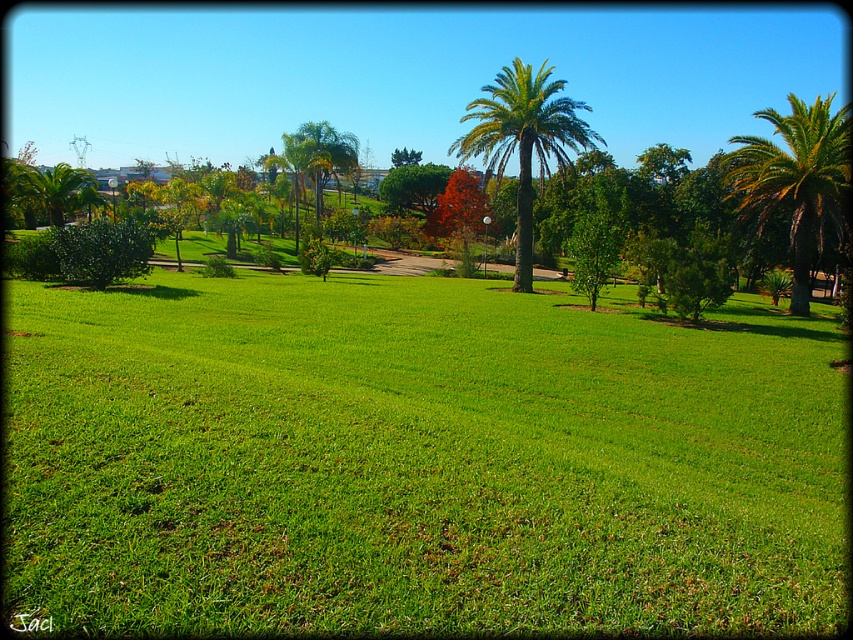
Does green leafy palm tree at right have a lesser width compared to green leafy palm at center?

No.

At what (x,y) coordinates should I click in order to perform the action: click on green leafy palm tree at right. Please return your answer as a coordinate pair (x, y). Looking at the image, I should click on (795, 177).

This screenshot has width=853, height=640. Describe the element at coordinates (416, 461) in the screenshot. I see `green grass at center` at that location.

Can you confirm if green grass at center is shorter than green leafy palm at center?

Correct, green grass at center is not as tall as green leafy palm at center.

Locate an element on the screen. The height and width of the screenshot is (640, 853). green grass at center is located at coordinates (416, 461).

In the scene shown: Who is positioned more to the right, green grass at center or green leafy palm tree at right?

green leafy palm tree at right is more to the right.

Consider the image. Who is higher up, green grass at center or green leafy palm tree at right?

green leafy palm tree at right is higher up.

You are a GUI agent. You are given a task and a screenshot of the screen. Output one action in this format:
    pyautogui.click(x=<x>, y=<y>)
    Task: Click on the green grass at center
    The width and height of the screenshot is (853, 640).
    Given the screenshot: What is the action you would take?
    pyautogui.click(x=416, y=461)